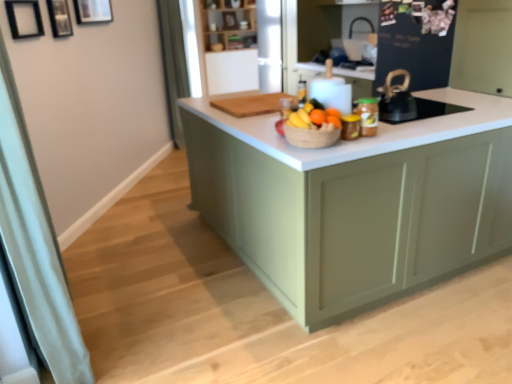
Question: Is orange matte at center shorter than white fabric curtain at left, the second curtain when ordered from top to bottom?

Choices:
 (A) yes
 (B) no

Answer: (A)

Question: Is orange matte at center thinner than white fabric curtain at left, marked as the first curtain in a bottom-to-top arrangement?

Choices:
 (A) yes
 (B) no

Answer: (A)

Question: Does orange matte at center appear on the right side of white fabric curtain at left, the second curtain when ordered from top to bottom?

Choices:
 (A) yes
 (B) no

Answer: (A)

Question: Would you say orange matte at center is a long distance from white fabric curtain at left, the second curtain when ordered from top to bottom?

Choices:
 (A) no
 (B) yes

Answer: (B)

Question: Would you say white fabric curtain at left, the second curtain when ordered from top to bottom, is part of orange matte at center's contents?

Choices:
 (A) no
 (B) yes

Answer: (A)

Question: Would you say white fabric curtain at left, positioned as the second curtain in back-to-front order, is to the left or to the right of green fabric curtain at left, which is the second curtain in bottom-to-top order, in the picture?

Choices:
 (A) right
 (B) left

Answer: (B)

Question: From the image's perspective, relative to green fabric curtain at left, which is the second curtain in bottom-to-top order, is white fabric curtain at left, the second curtain when ordered from top to bottom, above or below?

Choices:
 (A) below
 (B) above

Answer: (A)

Question: From a real-world perspective, relative to green fabric curtain at left, which is the second curtain in bottom-to-top order, is white fabric curtain at left, marked as the first curtain in a bottom-to-top arrangement, vertically above or below?

Choices:
 (A) below
 (B) above

Answer: (A)

Question: In terms of size, does white fabric curtain at left, the second curtain when ordered from top to bottom, appear bigger or smaller than green fabric curtain at left, the 1th curtain from the top?

Choices:
 (A) small
 (B) big

Answer: (B)

Question: From the image's perspective, is black matte picture frame at upper left, which ranks as the third picture frame in back-to-front order, located above or below wooden picture frame at upper left, which appears as the 3th picture frame when viewed from the front?

Choices:
 (A) below
 (B) above

Answer: (A)

Question: Is black matte picture frame at upper left, which ranks as the third picture frame in back-to-front order, to the left or to the right of wooden picture frame at upper left, which appears as the 3th picture frame when viewed from the front, in the image?

Choices:
 (A) right
 (B) left

Answer: (B)

Question: Is point (20, 6) closer or farther from the camera than point (105, 18)?

Choices:
 (A) closer
 (B) farther

Answer: (A)

Question: From a real-world perspective, is black matte picture frame at upper left, which ranks as the third picture frame in back-to-front order, positioned above or below wooden picture frame at upper left, arranged as the first picture frame when viewed from the back?

Choices:
 (A) above
 (B) below

Answer: (B)

Question: From the image's perspective, is wooden picture frame at upper left, arranged as the first picture frame when viewed from the back, located above or below green fabric curtain at left, acting as the 1th curtain starting from the back?

Choices:
 (A) above
 (B) below

Answer: (B)

Question: In terms of width, does wooden picture frame at upper left, arranged as the first picture frame when viewed from the back, look wider or thinner when compared to green fabric curtain at left, acting as the 1th curtain starting from the back?

Choices:
 (A) wide
 (B) thin

Answer: (B)